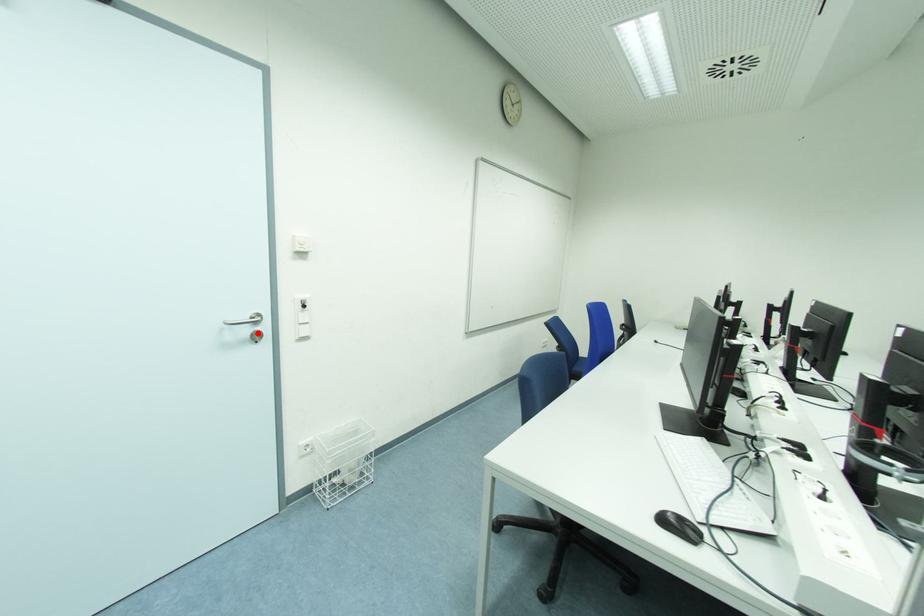
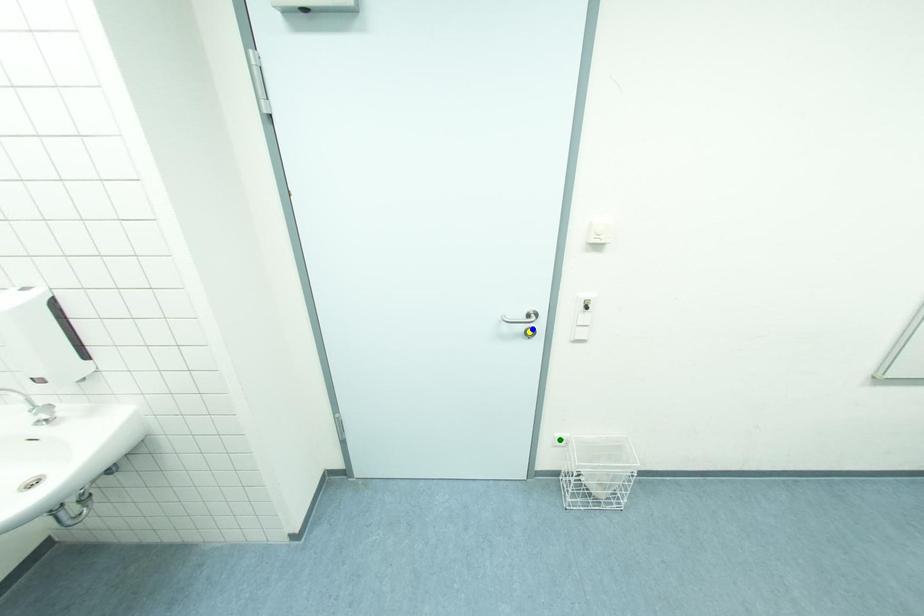
Question: I am providing you with two images of the same scene from different viewpoints. A red point is marked on the first image. You are given multiple points on the second image. In image 2, which mark is for the same physical point as the one in image 1?

Choices:
 (A) green point
 (B) yellow point
 (C) blue point

Answer: (C)